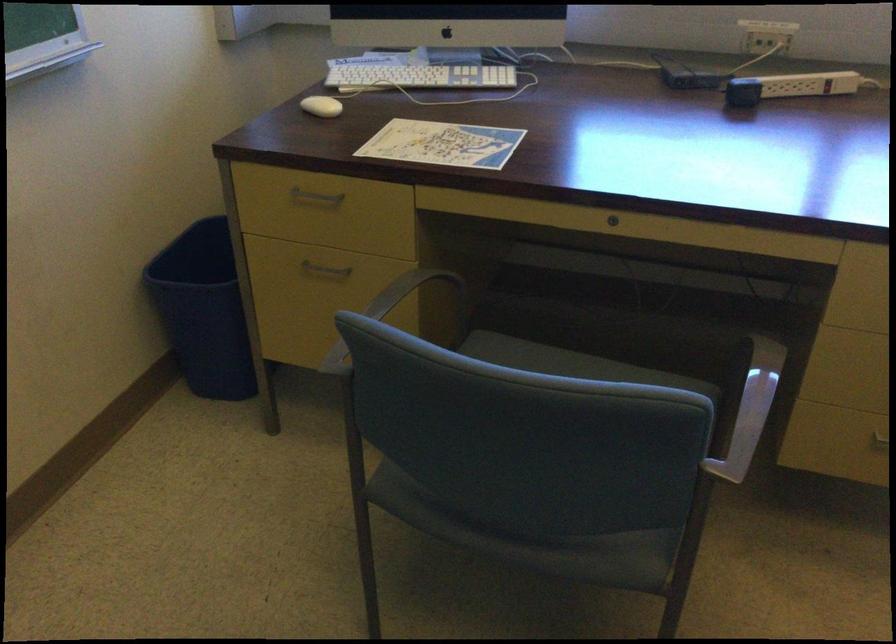
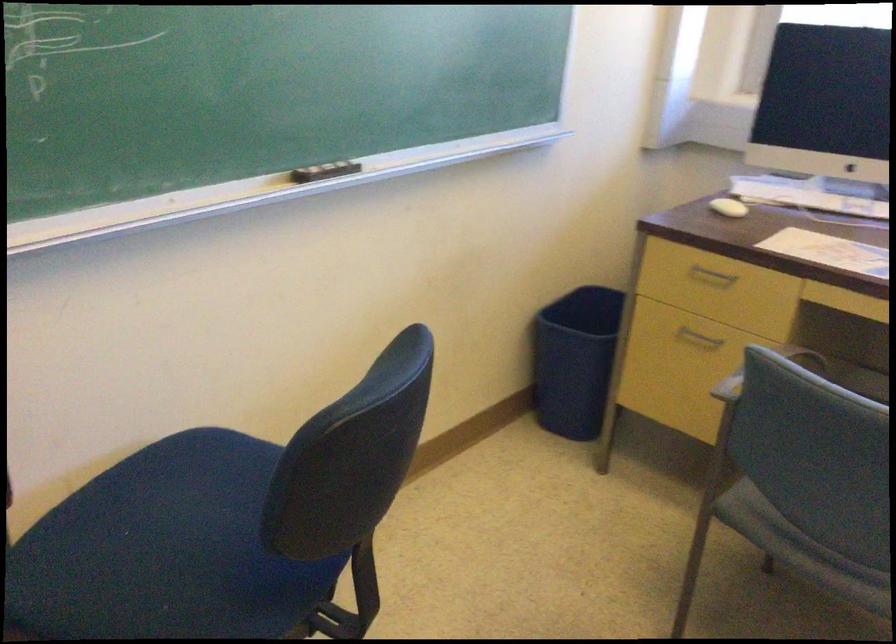
What movement of the cameraman would produce the second image?

The cameraman moved toward left, backward.